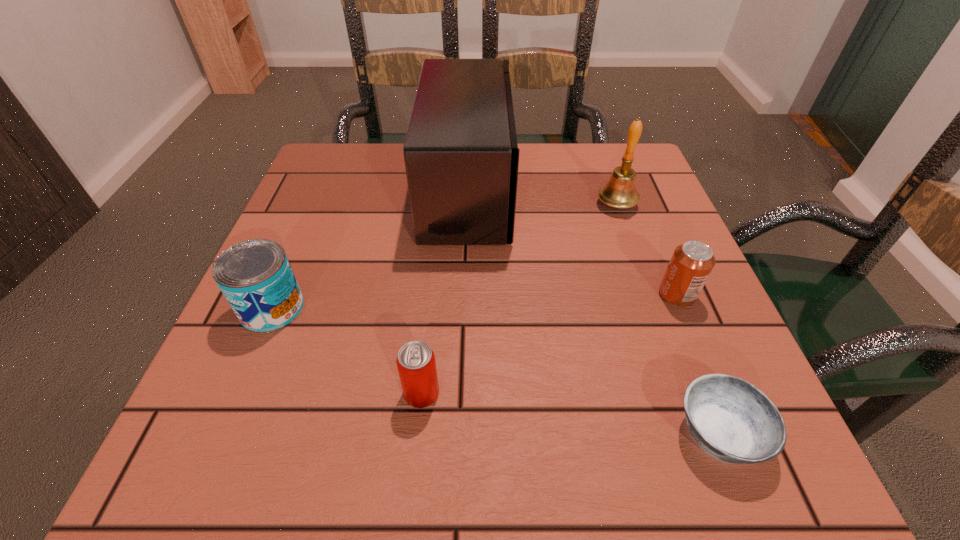
The image size is (960, 540). I want to click on can that stands as the second closest to the microwave_oven, so click(692, 262).

Find the location of a particular element. This screenshot has width=960, height=540. vacant area in the image that satisfies the following two spatial constraints: 1. on the front-facing side of the microwave_oven; 2. on the back side of the bell is located at coordinates (468, 205).

This screenshot has width=960, height=540. Identify the location of vacant area in the image that satisfies the following two spatial constraints: 1. on the back side of the shortest object; 2. on the right side of the rightmost can. (664, 295).

Identify the location of free location that satisfies the following two spatial constraints: 1. on the front-facing side of the bell; 2. on the right side of the microwave_oven. The image size is (960, 540). (468, 205).